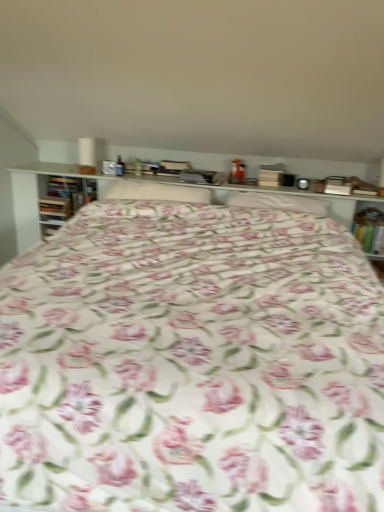
Image resolution: width=384 pixels, height=512 pixels. I want to click on blank space above wooden book at left, which appears as the third book when viewed from the right (from a real-world perspective), so click(x=62, y=196).